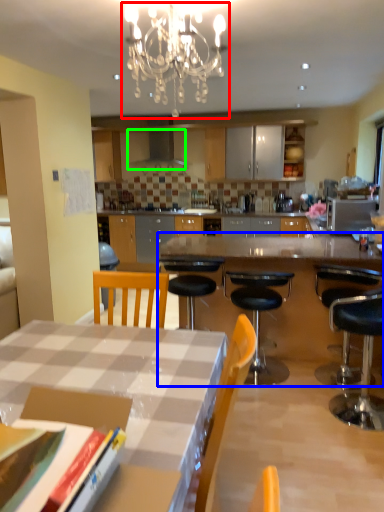
Question: Which object is positioned closest to light fixture (highlighted by a red box)? Select from table (highlighted by a blue box) and exhaust hood (highlighted by a green box).

Choices:
 (A) table
 (B) exhaust hood

Answer: (A)